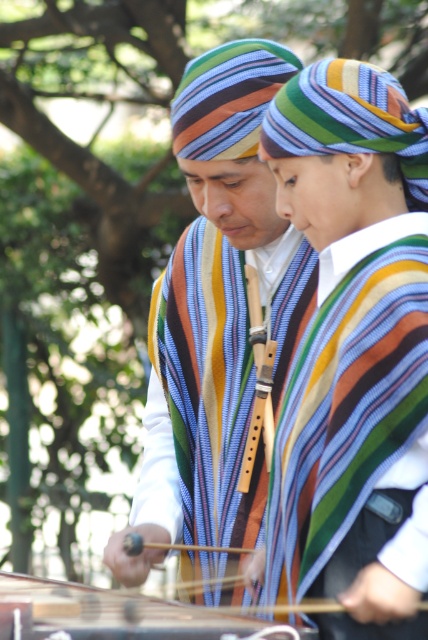
Is point (276, 80) closer to viewer compared to point (133, 621)?

No.

Can you confirm if striped fabric headscarf at center is bigger than wooden stringed instrument at center?

Yes.

Measure the distance between point (x=272, y=214) and camera.

The distance of point (x=272, y=214) from camera is 13.67 feet.

The image size is (428, 640). I want to click on striped fabric headscarf at center, so click(216, 310).